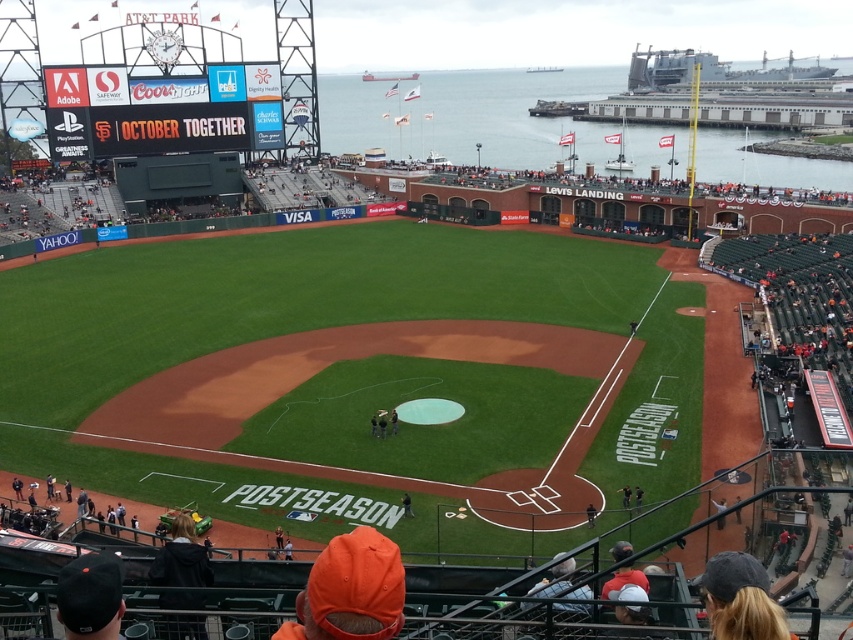
Does point (196, 544) come in front of point (587, 509)?

Yes, point (196, 544) is in front of point (587, 509).

Is point (190, 627) positioned behind point (593, 513)?

That is False.

Which is behind, point (181, 532) or point (590, 509)?

The point (590, 509) is more distant.

I want to click on dark brown leather jacket at lower left, so click(x=181, y=557).

Can you confirm if matte black scoreboard at upper center is positioned to the left of dark brown leather jacket at lower left?

Yes, matte black scoreboard at upper center is to the left of dark brown leather jacket at lower left.

Which is more to the left, matte black scoreboard at upper center or dark brown leather jacket at lower left?

From the viewer's perspective, matte black scoreboard at upper center appears more on the left side.

Between point (173, 118) and point (190, 604), which one is positioned in front?

Point (190, 604)

Identify the location of matte black scoreboard at upper center. Image resolution: width=853 pixels, height=640 pixels. (161, 112).

Which is below, orange fabric cap at lower center or orange baseball cap at lower center?

orange baseball cap at lower center is below.

In the scene shown: Does orange fabric cap at lower center have a smaller size compared to orange baseball cap at lower center?

Yes, orange fabric cap at lower center is smaller than orange baseball cap at lower center.

Who is more distant from viewer, (320, 589) or (589, 504)?

The point (589, 504) is more distant.

Locate an element on the screen. orange fabric cap at lower center is located at coordinates click(x=351, y=589).